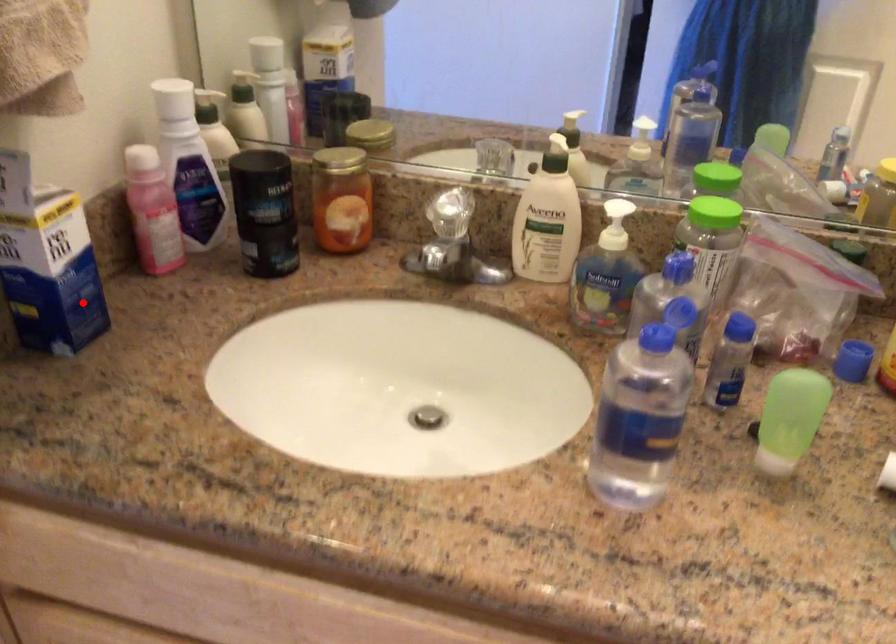
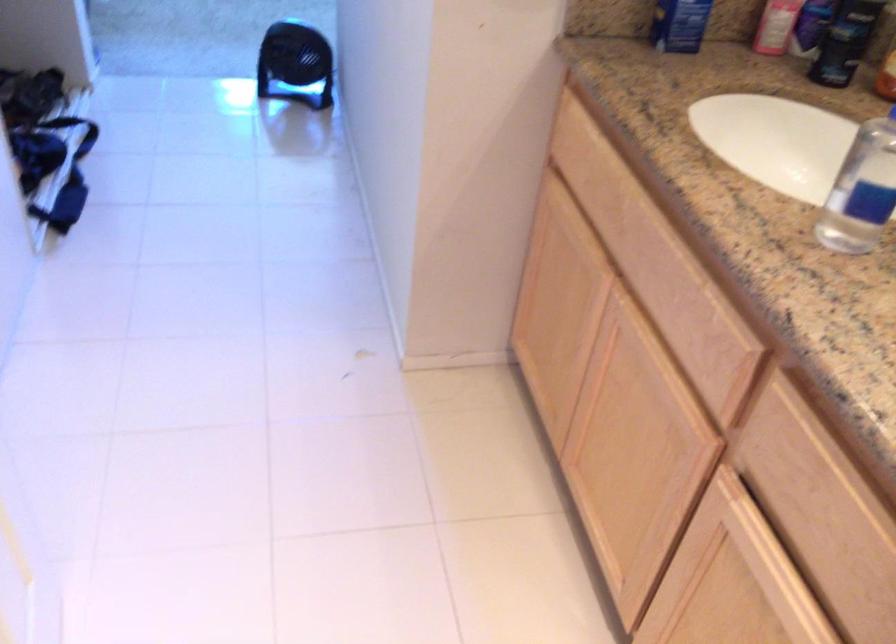
Question: I am providing you with two images of the same scene from different viewpoints. A red point is marked on the first image. Is the red point's position out of view in image 2?

Choices:
 (A) Yes
 (B) No

Answer: (B)